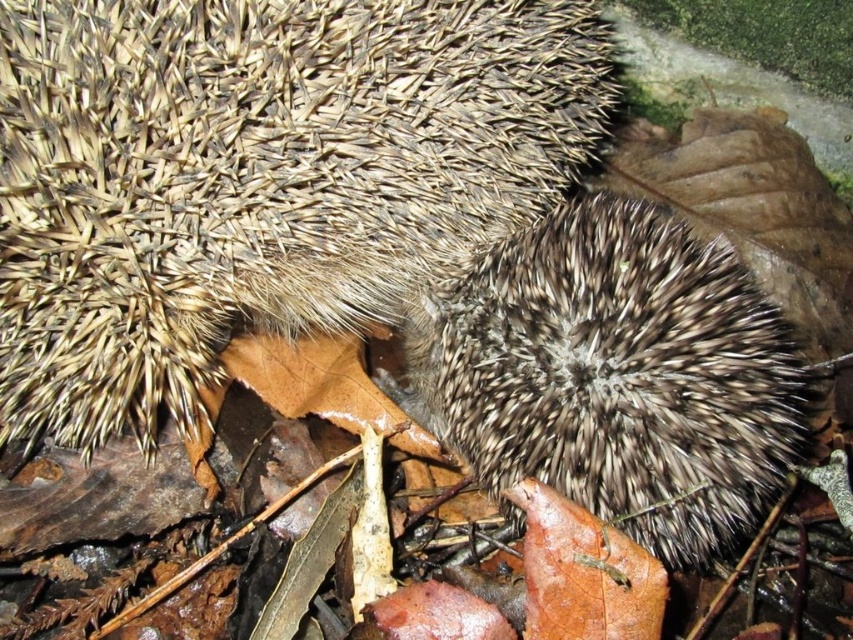
You are a photographer trying to capture the brown spiny hedgehog at center and the spiky brown hedgehog at center in a single frame. Which hedgehog is closer to the camera?

The brown spiny hedgehog at center is closer to the camera than the spiky brown hedgehog at center because it is positioned in front of it.

You are a nature photographer trying to capture the hedgehog with both the brown spiny hedgehog at center and the spiky brown hedgehog at center in your shot. Which hedgehog should you focus on if you want to highlight the one that stands taller in the frame?

The brown spiny hedgehog at center has a greater height compared to the spiky brown hedgehog at center, so you should focus on the brown spiny hedgehog at center to highlight the taller one.